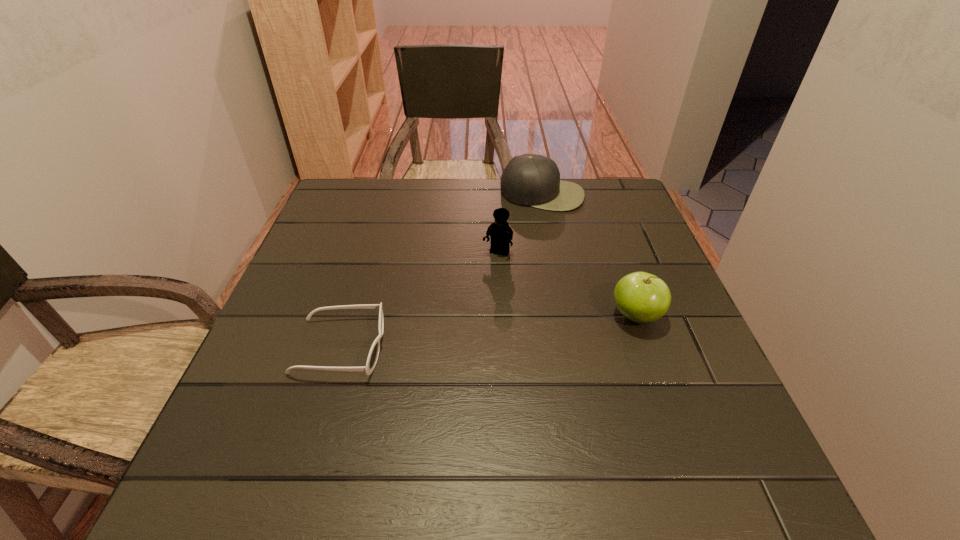
Where is `vacant region between the farthest object and the apple`? The image size is (960, 540). vacant region between the farthest object and the apple is located at coordinates (589, 255).

You are a GUI agent. You are given a task and a screenshot of the screen. Output one action in this format:
    pyautogui.click(x=<x>, y=<y>)
    Task: Click on the unoccupied position between the apple and the cap
    
    Given the screenshot: What is the action you would take?
    pyautogui.click(x=589, y=255)

Identify the location of vacant point located between the shortest object and the Lego. (x=419, y=300).

This screenshot has width=960, height=540. Identify the location of vacant region between the apple and the cap. (589, 255).

What are the coordinates of `free point between the leftmost object and the cap` in the screenshot? It's located at (442, 271).

Where is `vacant region between the apple and the shortest object`? This screenshot has width=960, height=540. vacant region between the apple and the shortest object is located at coordinates (488, 331).

Find the location of a particular element. The height and width of the screenshot is (540, 960). the second closest object to the cap is located at coordinates (641, 297).

You are a GUI agent. You are given a task and a screenshot of the screen. Output one action in this format:
    pyautogui.click(x=<x>, y=<y>)
    Task: Click on the object that can be found as the second closest to the cap
    This screenshot has height=540, width=960.
    Given the screenshot: What is the action you would take?
    pyautogui.click(x=641, y=297)

This screenshot has width=960, height=540. I want to click on free region that satisfies the following two spatial constraints: 1. on the back side of the farthest object; 2. on the right side of the second farthest object, so click(x=494, y=194).